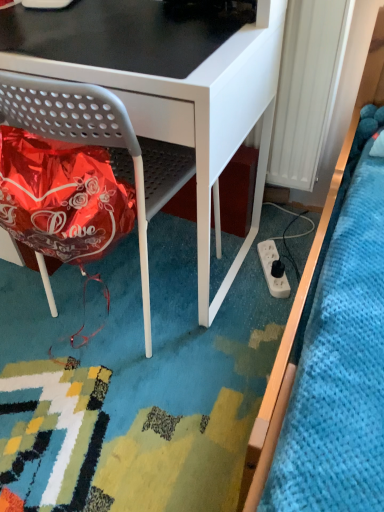
Question: Does matte gray chair at lower left have a lesser height compared to white plastic radiator at right?

Choices:
 (A) yes
 (B) no

Answer: (B)

Question: Is matte gray chair at lower left oriented towards white plastic radiator at right?

Choices:
 (A) yes
 (B) no

Answer: (B)

Question: From the image's perspective, is matte gray chair at lower left above white plastic radiator at right?

Choices:
 (A) no
 (B) yes

Answer: (A)

Question: From the image's perspective, is matte gray chair at lower left below white plastic radiator at right?

Choices:
 (A) yes
 (B) no

Answer: (A)

Question: Considering the relative sizes of matte gray chair at lower left and white plastic radiator at right in the image provided, is matte gray chair at lower left wider than white plastic radiator at right?

Choices:
 (A) no
 (B) yes

Answer: (B)

Question: From the image's perspective, is white plastic power plugs and sockets at lower right positioned above or below matte gray chair at lower left?

Choices:
 (A) below
 (B) above

Answer: (A)

Question: Visually, is white plastic power plugs and sockets at lower right positioned to the left or to the right of matte gray chair at lower left?

Choices:
 (A) right
 (B) left

Answer: (A)

Question: Do you think white plastic power plugs and sockets at lower right is within matte gray chair at lower left, or outside of it?

Choices:
 (A) outside
 (B) inside

Answer: (A)

Question: Is white plastic power plugs and sockets at lower right bigger or smaller than matte gray chair at lower left?

Choices:
 (A) small
 (B) big

Answer: (A)

Question: Which is correct: white plastic power plugs and sockets at lower right is inside white plastic radiator at right, or outside of it?

Choices:
 (A) inside
 (B) outside

Answer: (B)

Question: Looking at their shapes, would you say white plastic power plugs and sockets at lower right is wider or thinner than white plastic radiator at right?

Choices:
 (A) wide
 (B) thin

Answer: (A)

Question: In the image, is white plastic power plugs and sockets at lower right positioned in front of or behind white plastic radiator at right?

Choices:
 (A) behind
 (B) front

Answer: (A)

Question: Is point (269, 270) positioned closer to the camera than point (289, 122)?

Choices:
 (A) farther
 (B) closer

Answer: (A)

Question: Is point (170, 166) positioned closer to the camera than point (302, 160)?

Choices:
 (A) farther
 (B) closer

Answer: (B)

Question: Considering the positions of matte gray chair at lower left and white plastic radiator at right in the image, is matte gray chair at lower left taller or shorter than white plastic radiator at right?

Choices:
 (A) short
 (B) tall

Answer: (B)